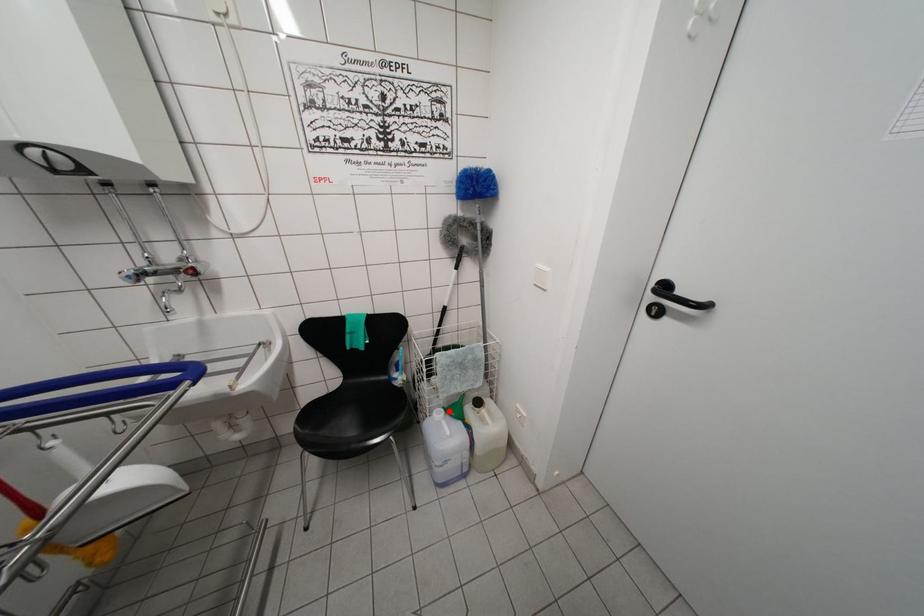
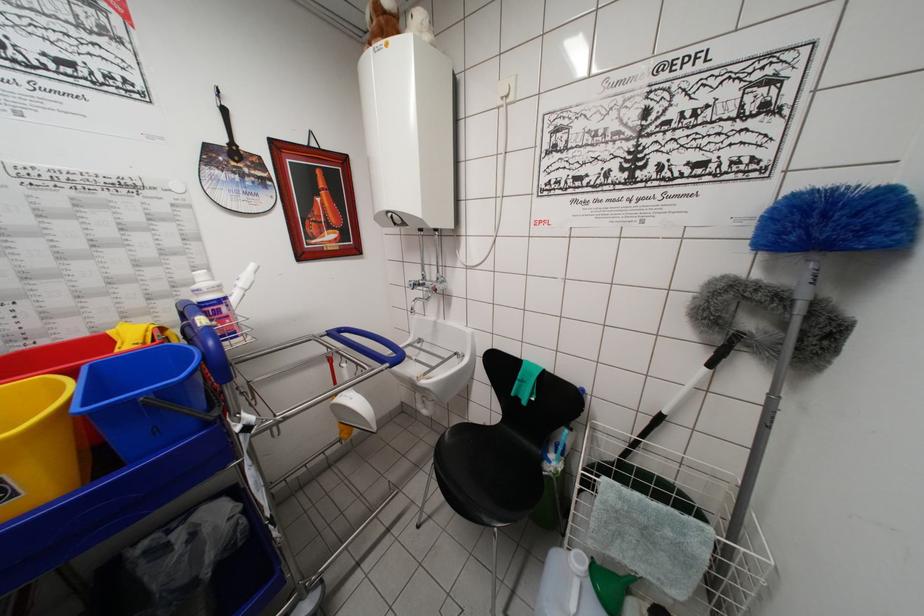
Where in the second image is the point corresponding to the highlighted location from the first image?

(601, 565)